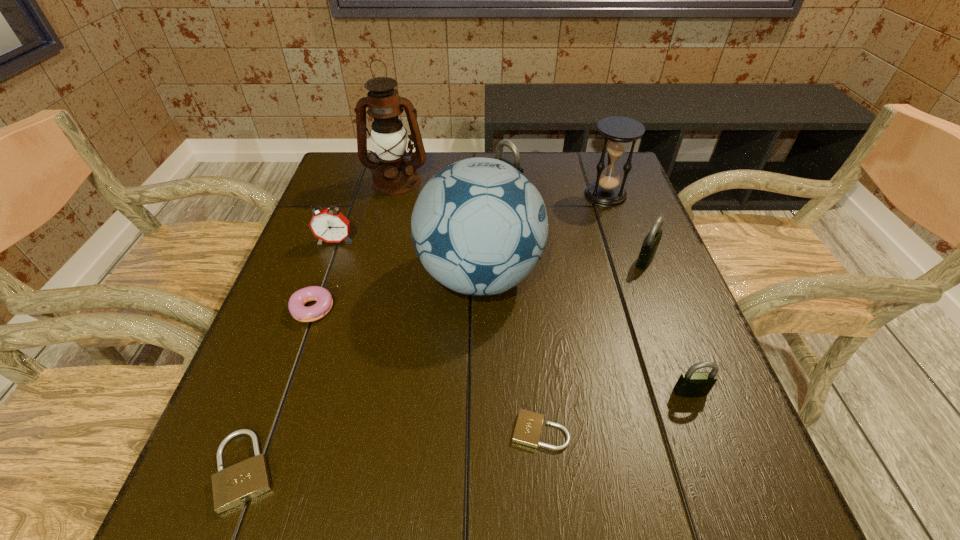
Where is `vacant point located between the shortest padlock and the leftmost black padlock`? vacant point located between the shortest padlock and the leftmost black padlock is located at coordinates (523, 310).

You are a GUI agent. You are given a task and a screenshot of the screen. Output one action in this format:
    pyautogui.click(x=<x>, y=<y>)
    Task: Click on the unoccupied area between the black hourglass and the third nearest object
    This screenshot has height=540, width=960.
    Given the screenshot: What is the action you would take?
    pyautogui.click(x=648, y=293)

At what (x,y) coordinates should I click in order to perform the action: click on free space that is in between the second farthest padlock and the shortest object. Please return your answer as a coordinate pair (x, y). Image resolution: width=960 pixels, height=540 pixels. Looking at the image, I should click on (592, 346).

Image resolution: width=960 pixels, height=540 pixels. I want to click on free area in between the doughnut and the nearest black padlock, so click(x=502, y=350).

Identify which object is the third nearest to the alarm clock. Please provide its 2D coordinates. Your answer should be formatted as a tuple, i.e. [(x, y)], where the tuple contains the x and y coordinates of a point satisfying the conditions above.

[(394, 175)]

Identify the location of the sixth closest object to the smallest black padlock. (239, 483).

What are the coordinates of `padlock that can be found as the third closest to the farthest black padlock` in the screenshot? It's located at (528, 427).

Image resolution: width=960 pixels, height=540 pixels. Identify the location of padlock that is the closest to the black hourglass. (650, 244).

Locate which black padlock ranks third in proximity to the hourglass. Please provide its 2D coordinates. Your answer should be formatted as a tuple, i.e. [(x, y)], where the tuple contains the x and y coordinates of a point satisfying the conditions above.

[(692, 384)]

Identify which black padlock is the second closest to the leftmost padlock. Please provide its 2D coordinates. Your answer should be formatted as a tuple, i.e. [(x, y)], where the tuple contains the x and y coordinates of a point satisfying the conditions above.

[(502, 143)]